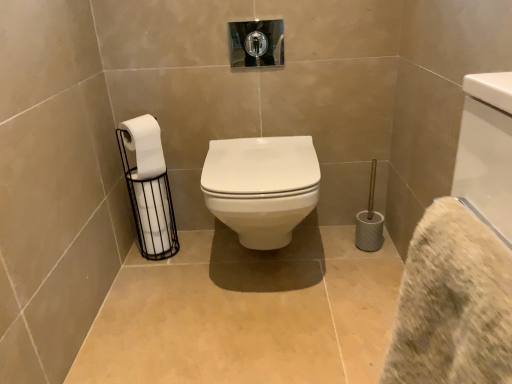
Question: From the image's perspective, is white matte toilet paper at left, which is the 1th toilet paper from bottom to top, located above white matte toilet paper at left, which is the 1th toilet paper in top-to-bottom order?

Choices:
 (A) no
 (B) yes

Answer: (A)

Question: Does white matte toilet paper at left, which is the 2th toilet paper in top-to-bottom order, have a greater width compared to white matte toilet paper at left, which is the 1th toilet paper in top-to-bottom order?

Choices:
 (A) no
 (B) yes

Answer: (B)

Question: Does white matte toilet paper at left, which is the 1th toilet paper from bottom to top, have a greater height compared to white matte toilet paper at left, which is the 1th toilet paper in top-to-bottom order?

Choices:
 (A) no
 (B) yes

Answer: (B)

Question: Is white matte toilet paper at left, the second toilet paper in the bottom-to-top sequence, at the back of white matte toilet paper at left, which is the 1th toilet paper from bottom to top?

Choices:
 (A) no
 (B) yes

Answer: (B)

Question: Does white matte toilet paper at left, which is the 2th toilet paper in top-to-bottom order, come in front of white matte toilet paper at left, the second toilet paper in the bottom-to-top sequence?

Choices:
 (A) no
 (B) yes

Answer: (A)

Question: Considering the positions of white matte toilet paper at left, which is the 2th toilet paper in top-to-bottom order, and white glossy toilet at center in the image, is white matte toilet paper at left, which is the 2th toilet paper in top-to-bottom order, bigger or smaller than white glossy toilet at center?

Choices:
 (A) big
 (B) small

Answer: (B)

Question: Is point (123, 165) closer or farther from the camera than point (244, 205)?

Choices:
 (A) closer
 (B) farther

Answer: (B)

Question: From a real-world perspective, is white matte toilet paper at left, which is the 1th toilet paper from bottom to top, positioned above or below white glossy toilet at center?

Choices:
 (A) above
 (B) below

Answer: (B)

Question: In the image, is white matte toilet paper at left, which is the 2th toilet paper in top-to-bottom order, on the left side or the right side of white glossy toilet at center?

Choices:
 (A) left
 (B) right

Answer: (A)

Question: Do you think white matte toilet paper at left, which is the 2th toilet paper in top-to-bottom order, is within white matte toilet paper at left, which is the 1th toilet paper in top-to-bottom order, or outside of it?

Choices:
 (A) outside
 (B) inside

Answer: (A)

Question: Considering the positions of point (138, 175) and point (123, 137), is point (138, 175) closer or farther from the camera than point (123, 137)?

Choices:
 (A) closer
 (B) farther

Answer: (B)

Question: From a real-world perspective, relative to white matte toilet paper at left, which is the 1th toilet paper in top-to-bottom order, is white matte toilet paper at left, which is the 1th toilet paper from bottom to top, vertically above or below?

Choices:
 (A) above
 (B) below

Answer: (B)

Question: Considering the positions of white matte toilet paper at left, which is the 2th toilet paper in top-to-bottom order, and white matte toilet paper at left, the second toilet paper in the bottom-to-top sequence, in the image, is white matte toilet paper at left, which is the 2th toilet paper in top-to-bottom order, taller or shorter than white matte toilet paper at left, the second toilet paper in the bottom-to-top sequence,?

Choices:
 (A) tall
 (B) short

Answer: (A)

Question: Is white matte toilet paper at left, the second toilet paper in the bottom-to-top sequence, in front of or behind white matte toilet paper at left, which is the 2th toilet paper in top-to-bottom order, in the image?

Choices:
 (A) front
 (B) behind

Answer: (A)

Question: From the image's perspective, is white matte toilet paper at left, which is the 1th toilet paper in top-to-bottom order, positioned above or below white matte toilet paper at left, which is the 1th toilet paper from bottom to top?

Choices:
 (A) below
 (B) above

Answer: (B)